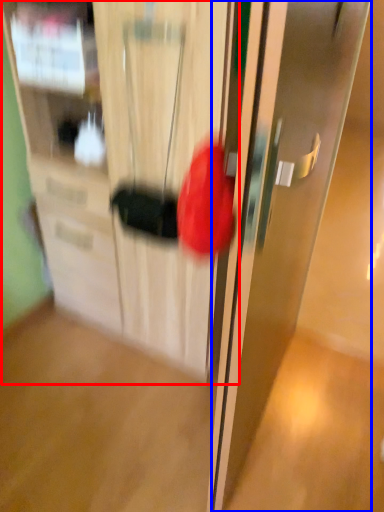
Question: Which object is further to the camera taking this photo, cabinetry (highlighted by a red box) or door (highlighted by a blue box)?

Choices:
 (A) cabinetry
 (B) door

Answer: (A)